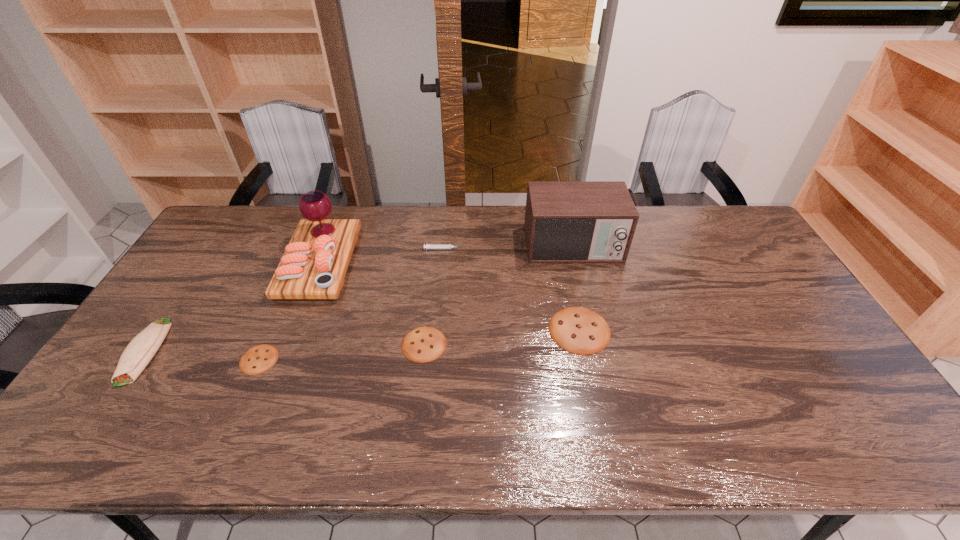
Find the location of `free space that satisfies the following two spatial constraints: 1. at the needle end of the syringe; 2. on the front side of the leftmost cookie`. free space that satisfies the following two spatial constraints: 1. at the needle end of the syringe; 2. on the front side of the leftmost cookie is located at coordinates (435, 360).

In order to click on vacant point that satisfies the following two spatial constraints: 1. on the front-facing side of the radio receiver; 2. at the needle end of the syringe in this screenshot , I will do `click(573, 249)`.